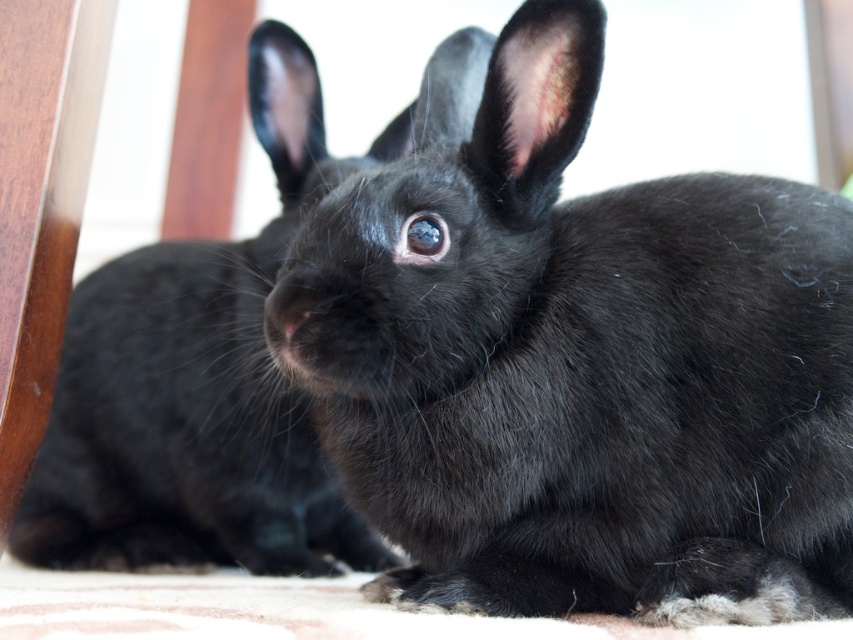
You are a photographer aiming to capture a closeup of the black fur rabbit at center without the black furry rabbit at center blocking the view. Can you adjust your position to achieve this?

The black fur rabbit at center is closer to the viewer than the black furry rabbit at center, so moving your camera position slightly forward or adjusting the angle could allow you to focus on the black fur rabbit at center while avoiding the black furry rabbit at center.

You are a photographer trying to capture both rabbits in a single frame. Given that the black fur rabbit at center is smaller in width than the black furry rabbit at center, which rabbit should you position closer to the camera to ensure both appear equally sized in the photo?

To make both rabbits appear equally sized in the photo, position the black fur rabbit at center closer to the camera since it has a lesser width compared to the black furry rabbit at center. This adjustment will help balance their apparent sizes in the frame.